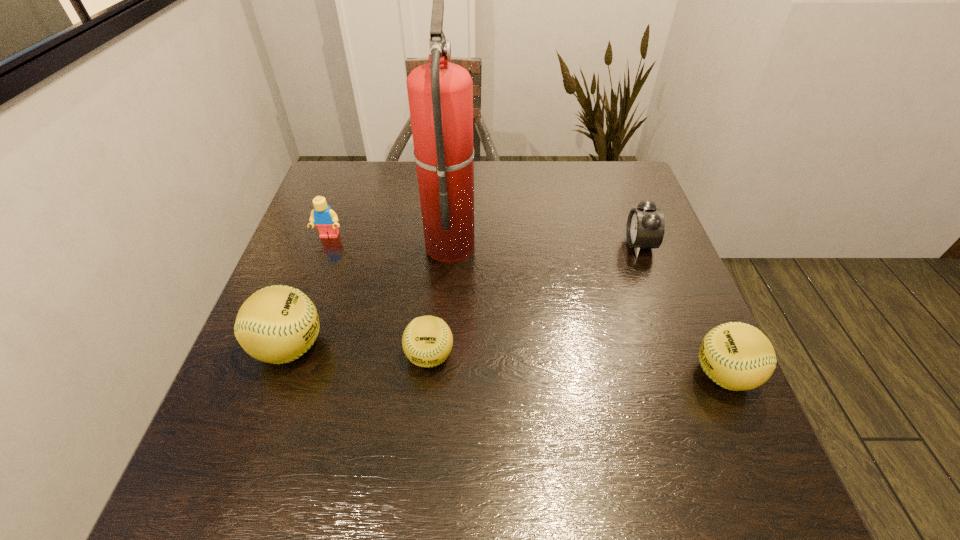
You are a GUI agent. You are given a task and a screenshot of the screen. Output one action in this format:
    pyautogui.click(x=<x>, y=<y>)
    Task: Click on the free region located on the logo side of the second tallest softball
    
    Given the screenshot: What is the action you would take?
    pyautogui.click(x=575, y=374)

Locate an element on the screen. The height and width of the screenshot is (540, 960). free location located 0.130m on the logo side of the second tallest softball is located at coordinates (626, 374).

Where is `vacant space situated 0.380m on the front side of the alarm clock`? The width and height of the screenshot is (960, 540). vacant space situated 0.380m on the front side of the alarm clock is located at coordinates (479, 245).

Locate an element on the screen. This screenshot has height=540, width=960. free spot located on the front side of the alarm clock is located at coordinates (591, 245).

Identify the location of blank space located 0.310m on the front side of the alarm clock. This screenshot has height=540, width=960. (506, 245).

Locate an element on the screen. The height and width of the screenshot is (540, 960). free space located 0.340m with the nozzle and gauge on the fire extinguisher is located at coordinates (607, 244).

Locate an element on the screen. The width and height of the screenshot is (960, 540). free space located on the front-facing side of the Lego is located at coordinates (320, 264).

Where is `object present at the near edge`? The width and height of the screenshot is (960, 540). object present at the near edge is located at coordinates (737, 356).

I want to click on softball that is at the left edge, so click(x=277, y=324).

This screenshot has height=540, width=960. What are the coordinates of `Lego positioned at the left edge` in the screenshot? It's located at (326, 220).